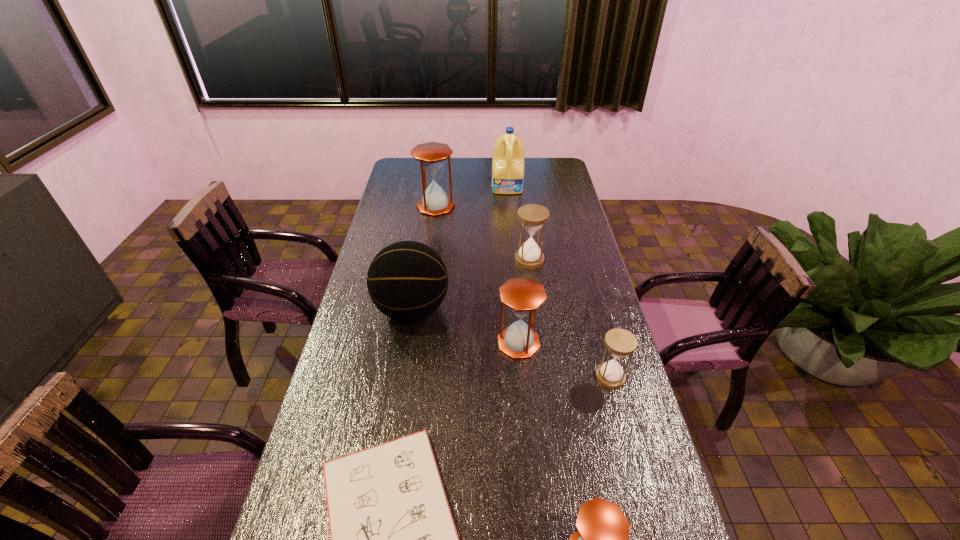
Find the location of a particular element. Image resolution: width=960 pixels, height=540 pixels. hourglass that is the second nearest to the left white hourglass is located at coordinates (432, 155).

The height and width of the screenshot is (540, 960). In order to click on brown hourglass that stands as the closest to the bigger white hourglass in this screenshot , I will do `click(522, 296)`.

The height and width of the screenshot is (540, 960). Identify the location of the second closest brown hourglass to the nearest brown hourglass. (432, 155).

Where is `vacant position in the image that satisfies the following two spatial constraints: 1. on the label of the farthest object; 2. on the right side of the third farthest object`? The image size is (960, 540). vacant position in the image that satisfies the following two spatial constraints: 1. on the label of the farthest object; 2. on the right side of the third farthest object is located at coordinates 515,260.

Image resolution: width=960 pixels, height=540 pixels. Find the location of `free space that satisfies the following two spatial constraints: 1. on the back side of the bigger white hourglass; 2. on the right side of the basketball`. free space that satisfies the following two spatial constraints: 1. on the back side of the bigger white hourglass; 2. on the right side of the basketball is located at coordinates (420, 260).